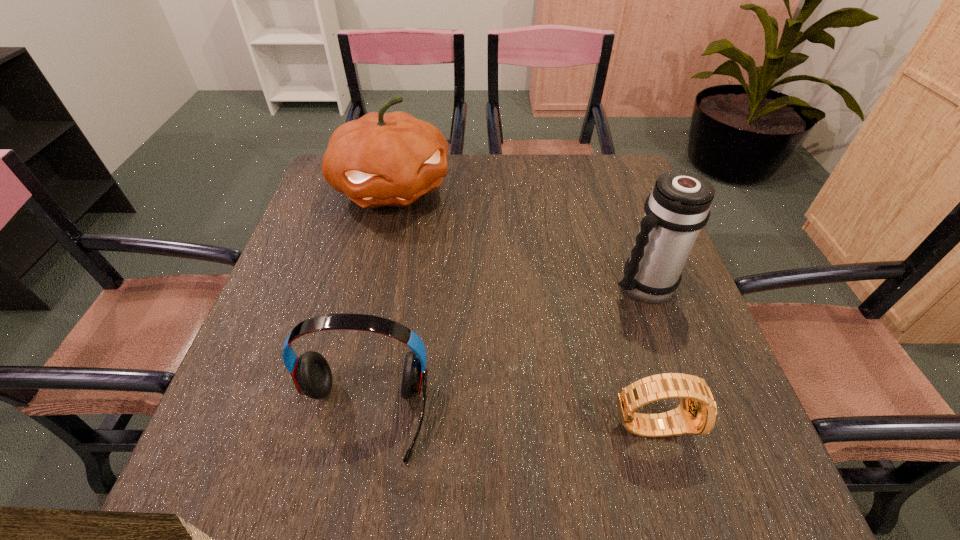
Image resolution: width=960 pixels, height=540 pixels. Identify the location of vacant space located 0.120m on the front face of the pumpkin. (428, 249).

Find the location of `object that is at the far edge`. object that is at the far edge is located at coordinates (382, 159).

Find the location of a particular element. This screenshot has height=540, width=960. headset positioned at the near edge is located at coordinates click(311, 373).

I want to click on watch at the near edge, so click(697, 413).

Find the location of a particular element. The width and height of the screenshot is (960, 540). headset at the left edge is located at coordinates (311, 373).

Identify the location of pumpkin present at the left edge. (382, 159).

Find the location of a particular element. watch that is at the right edge is located at coordinates (697, 413).

At what (x,y) coordinates should I click in order to perform the action: click on thermos bottle that is at the right edge. Please return your answer as a coordinate pair (x, y). Looking at the image, I should click on (678, 207).

In order to click on object at the far left corner in this screenshot , I will do `click(382, 159)`.

Identify the location of object present at the near left corner. (311, 373).